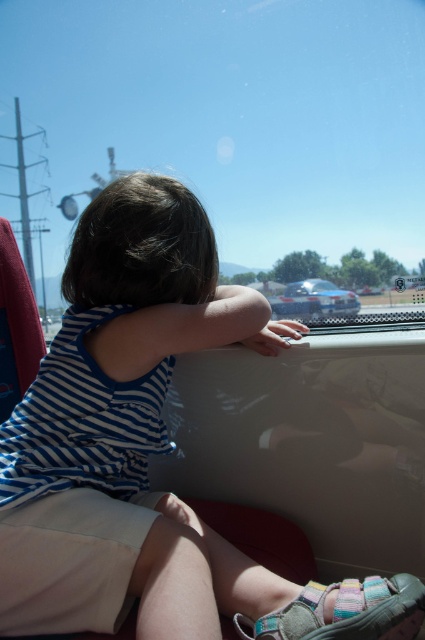
You are a passenger in the vehicle and want to place your multicolored fabric sandal at lower center on the floor. Based on the coordinates provided, where exactly should you place it?

The multicolored fabric sandal at lower center should be placed at the coordinates point [345,611].

Looking at the scene inside the vehicle, where is the blue striped tank top at center in relation to the multicolored fabric sandal at lower center?

The blue striped tank top at center is to the left of the multicolored fabric sandal at lower center.